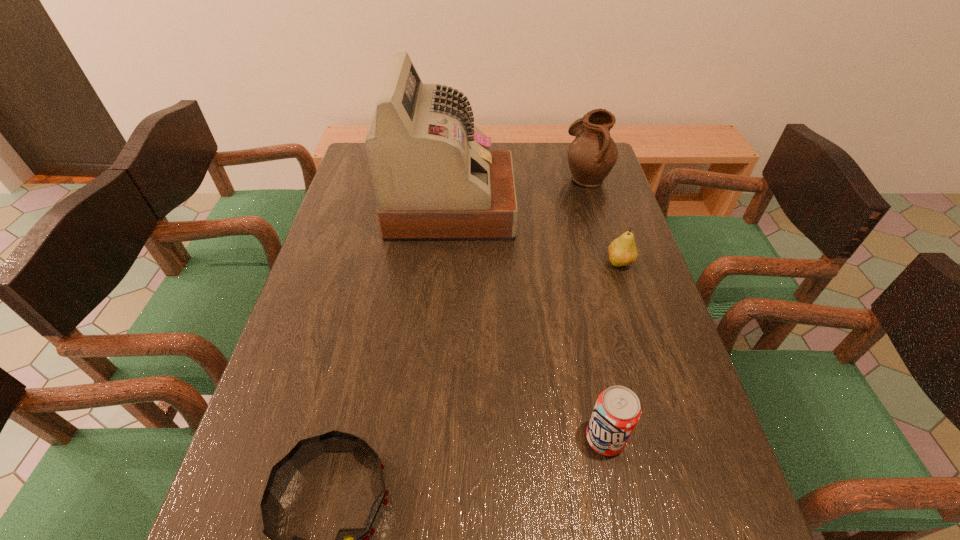
Where is `object that is the closest one to the pitcher`? object that is the closest one to the pitcher is located at coordinates (435, 178).

Identify the location of free spot that satisfies the following two spatial constraints: 1. on the operating side of the cash register; 2. on the left side of the soda can. (433, 440).

I want to click on vacant space that satisfies the following two spatial constraints: 1. at the spout of the fourth shortest object; 2. on the right side of the pear, so tap(612, 264).

Locate an element on the screen. The height and width of the screenshot is (540, 960). free space that satisfies the following two spatial constraints: 1. on the operating side of the shortest object; 2. on the right side of the tallest object is located at coordinates (446, 264).

I want to click on free space in the image that satisfies the following two spatial constraints: 1. on the back side of the soda can; 2. on the operating side of the tallest object, so click(x=558, y=206).